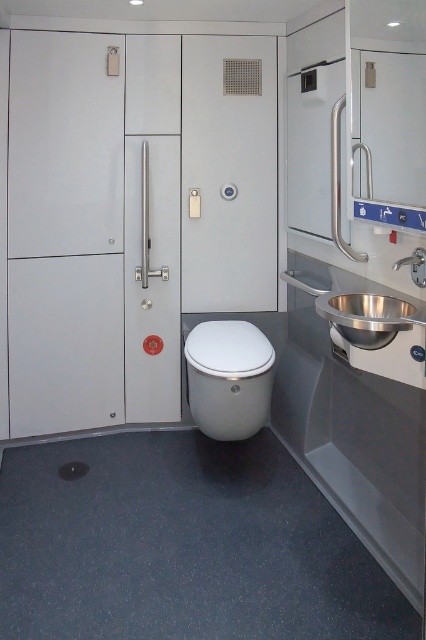
You are a maintenance worker checking the restroom layout. You need to locate the white glossy toilet bowl at center and the satin stainless steel sink at right. From the perspective of someone standing in the restroom, which object is positioned to the left of the other?

The white glossy toilet bowl at center is positioned to the left of the satin stainless steel sink at right.

You are an interior designer planning to install a new toilet and sink in a small bathroom. You have the white glossy toilet bowl at center and the satin stainless steel sink at right. Which of these two items takes up more space in the bathroom?

The white glossy toilet bowl at center is larger in size than the satin stainless steel sink at right, so it takes up more space in the bathroom.